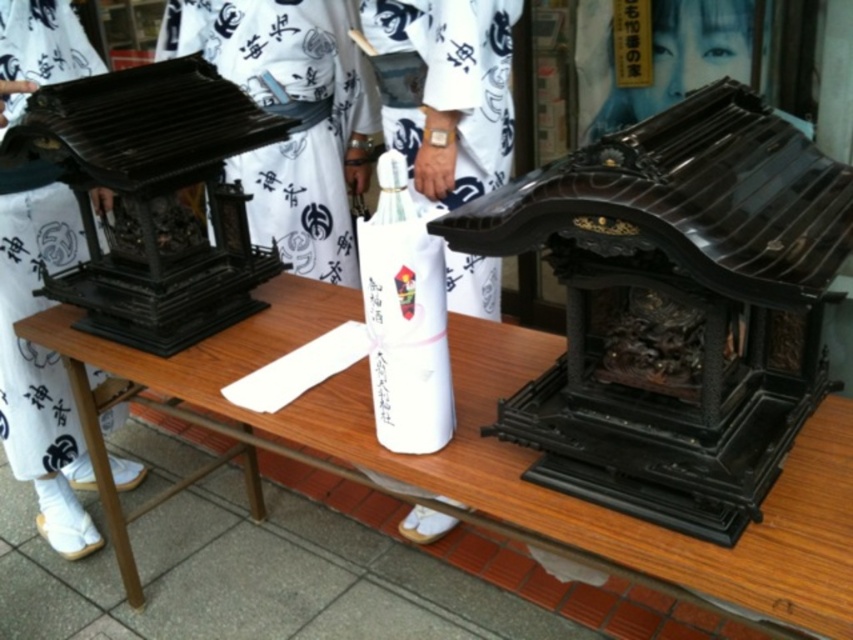
Is point (262, 4) positioned in front of point (26, 234)?

No, it is behind (26, 234).

In the scene shown: Can you confirm if matte black shrine at left is shorter than white cotton kimono at center?

Yes.

This screenshot has width=853, height=640. What do you see at coordinates (292, 115) in the screenshot?
I see `matte black shrine at left` at bounding box center [292, 115].

I want to click on matte black shrine at left, so click(x=292, y=115).

Image resolution: width=853 pixels, height=640 pixels. Identify the location of white silk robe at center. (445, 92).

Who is lower down, white silk robe at center or white cotton kimono at center?

white cotton kimono at center is below.

Measure the distance between white silk robe at center and camera.

white silk robe at center and camera are 5.25 feet apart.

At what (x,y) coordinates should I click in order to perform the action: click on white silk robe at center. Please return your answer as a coordinate pair (x, y). Looking at the image, I should click on (445, 92).

I want to click on wooden table at center, so click(x=476, y=456).

How far apart are wooden table at center and matte black shrine at left?

68.11 centimeters

The image size is (853, 640). In order to click on wooden table at center in this screenshot , I will do `click(476, 456)`.